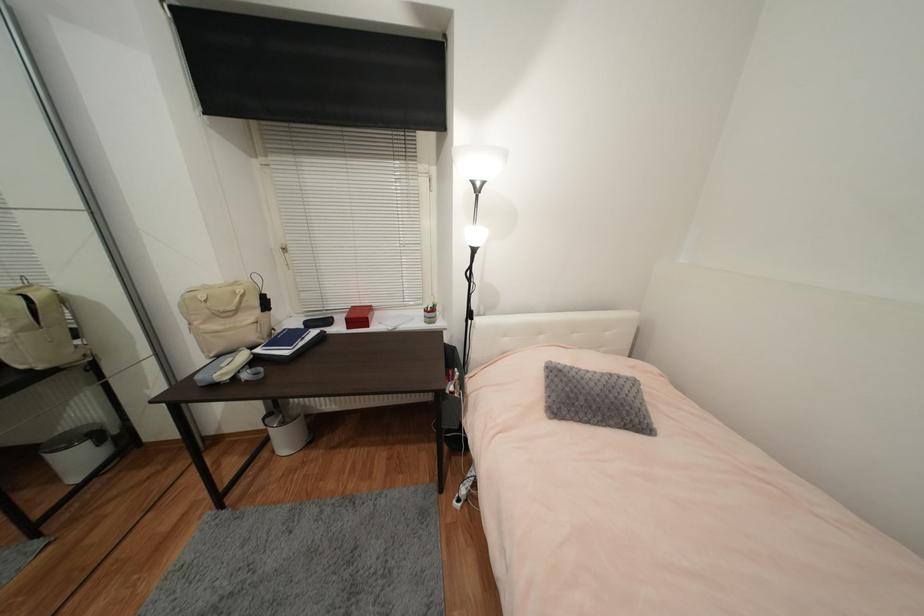
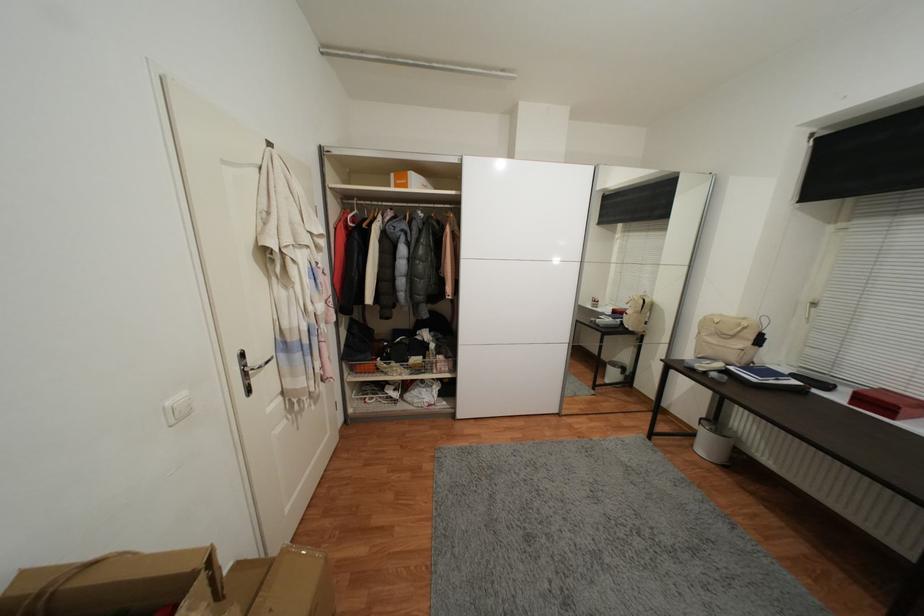
Question: Based on the continuous images, in which direction is the camera rotating? Reply with the corresponding letter.

Choices:
 (A) Left
 (B) Right
 (C) Up
 (D) Down

Answer: (A)